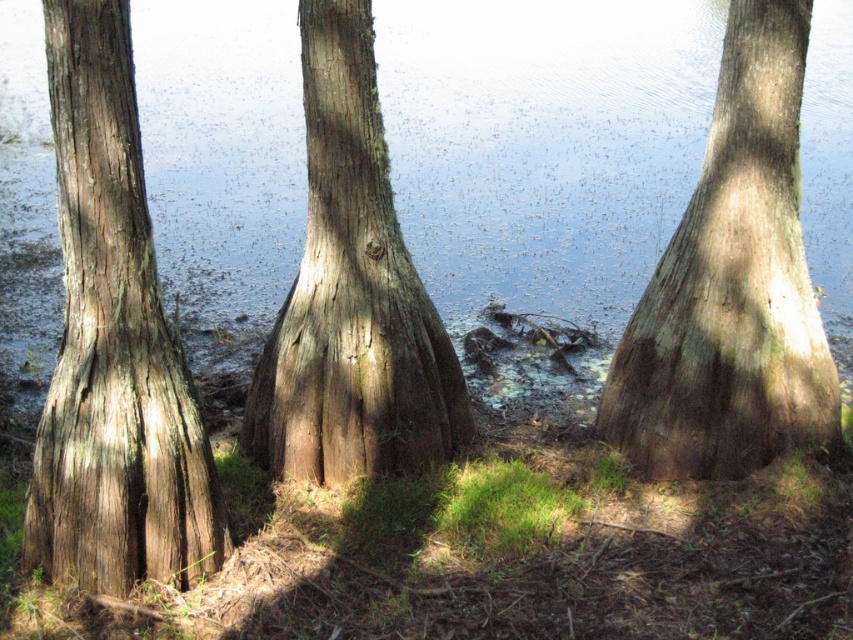
Is smooth brown tree trunk at left shorter than smooth brown tree trunk at right?

Indeed, smooth brown tree trunk at left has a lesser height compared to smooth brown tree trunk at right.

Is smooth brown tree trunk at left taller than smooth brown tree trunk at right?

Incorrect, smooth brown tree trunk at left's height is not larger of smooth brown tree trunk at right's.

Does point (111, 97) come in front of point (662, 468)?

Yes.

At what (x,y) coordinates should I click in order to perform the action: click on smooth brown tree trunk at left. Please return your answer as a coordinate pair (x, y). The image size is (853, 640). Looking at the image, I should click on (113, 346).

Between smooth brown tree trunk at right and smooth brown tree trunk at center, which one is positioned lower?

smooth brown tree trunk at right is lower down.

Who is more forward, (x=688, y=369) or (x=276, y=368)?

Positioned in front is point (x=688, y=369).

Does point (775, 115) lie in front of point (299, 465)?

Yes, point (775, 115) is in front of point (299, 465).

I want to click on smooth brown tree trunk at right, so click(732, 285).

Can you confirm if clear water at center is wider than smooth brown tree trunk at center?

Yes.

Is point (403, 150) in front of point (335, 272)?

No, (403, 150) is further to viewer.

This screenshot has width=853, height=640. Find the location of `clear water at center`. clear water at center is located at coordinates (543, 145).